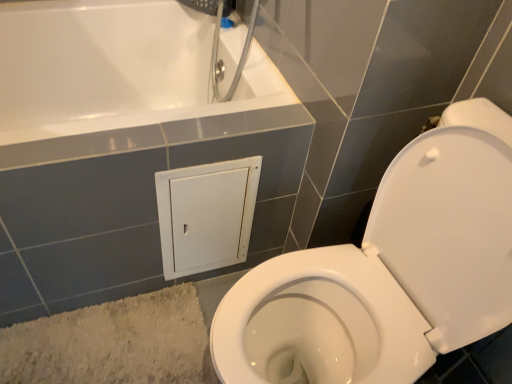
Question: Should I look upward or downward to see beige textured bath mat at lower left?

Choices:
 (A) up
 (B) down

Answer: (B)

Question: From the image's perspective, would you say beige textured bath mat at lower left is shown under white glossy toilet at lower right?

Choices:
 (A) no
 (B) yes

Answer: (B)

Question: Does beige textured bath mat at lower left have a greater height compared to white glossy toilet at lower right?

Choices:
 (A) yes
 (B) no

Answer: (B)

Question: Does beige textured bath mat at lower left come behind white glossy toilet at lower right?

Choices:
 (A) no
 (B) yes

Answer: (B)

Question: Considering the relative sizes of beige textured bath mat at lower left and white glossy toilet at lower right in the image provided, is beige textured bath mat at lower left wider than white glossy toilet at lower right?

Choices:
 (A) no
 (B) yes

Answer: (A)

Question: Considering the relative positions of beige textured bath mat at lower left and white glossy toilet at lower right in the image provided, is beige textured bath mat at lower left in front of white glossy toilet at lower right?

Choices:
 (A) no
 (B) yes

Answer: (A)

Question: Is beige textured bath mat at lower left placed right next to white glossy toilet at lower right?

Choices:
 (A) yes
 (B) no

Answer: (B)

Question: Would you consider white glossy toilet at lower right to be distant from beige textured bath mat at lower left?

Choices:
 (A) yes
 (B) no

Answer: (B)

Question: Does white glossy toilet at lower right have a smaller size compared to beige textured bath mat at lower left?

Choices:
 (A) yes
 (B) no

Answer: (B)

Question: Does white glossy toilet at lower right come behind beige textured bath mat at lower left?

Choices:
 (A) no
 (B) yes

Answer: (A)

Question: Considering the relative positions of white glossy toilet at lower right and beige textured bath mat at lower left in the image provided, is white glossy toilet at lower right to the left of beige textured bath mat at lower left from the viewer's perspective?

Choices:
 (A) no
 (B) yes

Answer: (A)

Question: Is the surface of white glossy toilet at lower right in direct contact with beige textured bath mat at lower left?

Choices:
 (A) yes
 (B) no

Answer: (B)

Question: From the image's perspective, is white glossy toilet at lower right located above beige textured bath mat at lower left?

Choices:
 (A) yes
 (B) no

Answer: (A)

Question: In terms of size, does white glossy toilet at lower right appear bigger or smaller than beige textured bath mat at lower left?

Choices:
 (A) small
 (B) big

Answer: (B)